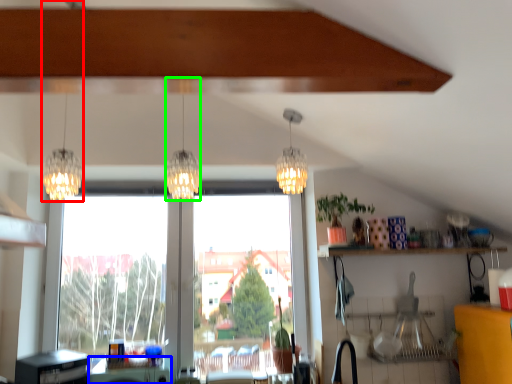
Question: Based on their relative distances, which object is farther from lamp (highlighted by a red box)? Choose from table (highlighted by a blue box) and lamp (highlighted by a green box).

Choices:
 (A) table
 (B) lamp

Answer: (A)